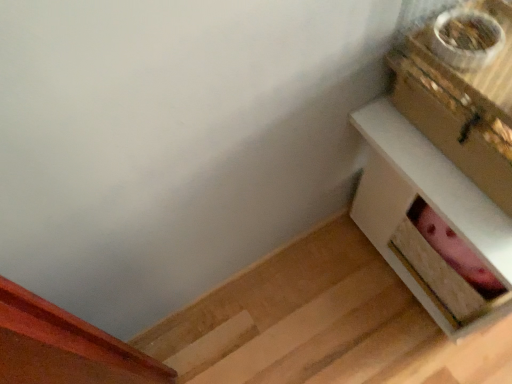
Question: Is white wood table at right taller or shorter than gold metallic box at upper right?

Choices:
 (A) short
 (B) tall

Answer: (B)

Question: Is point (437, 294) closer or farther from the camera than point (499, 6)?

Choices:
 (A) closer
 (B) farther

Answer: (B)

Question: From the image's perspective, is white wood table at right above or below gold metallic box at upper right?

Choices:
 (A) above
 (B) below

Answer: (B)

Question: From the image's perspective, is gold metallic box at upper right located above or below white wood table at right?

Choices:
 (A) above
 (B) below

Answer: (A)

Question: Is point (486, 180) closer or farther from the camera than point (490, 322)?

Choices:
 (A) farther
 (B) closer

Answer: (B)

Question: From a real-world perspective, is gold metallic box at upper right physically located above or below white wood table at right?

Choices:
 (A) above
 (B) below

Answer: (A)

Question: Do you think gold metallic box at upper right is within white wood table at right, or outside of it?

Choices:
 (A) inside
 (B) outside

Answer: (B)